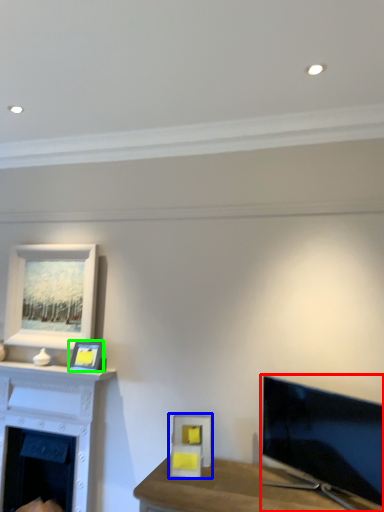
Question: Which is farther away from television (highlighted by a red box)? picture frame (highlighted by a blue box) or picture frame (highlighted by a green box)?

Choices:
 (A) picture frame
 (B) picture frame

Answer: (B)